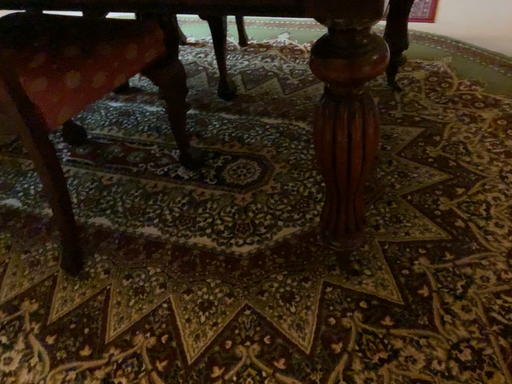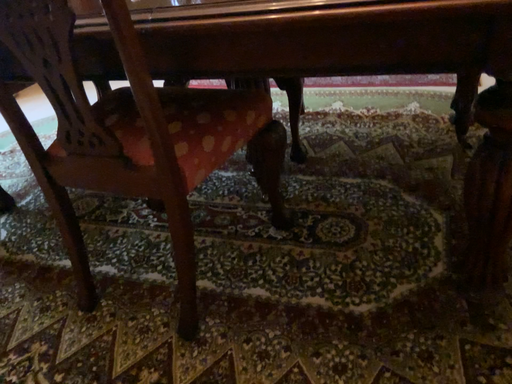
Question: How did the camera likely rotate when shooting the video?

Choices:
 (A) rotated downward
 (B) rotated upward

Answer: (B)